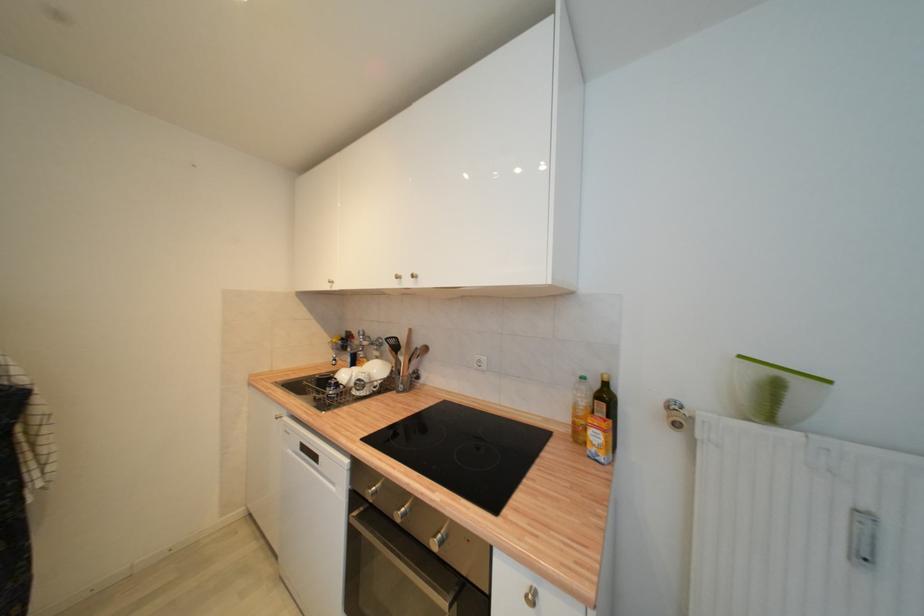
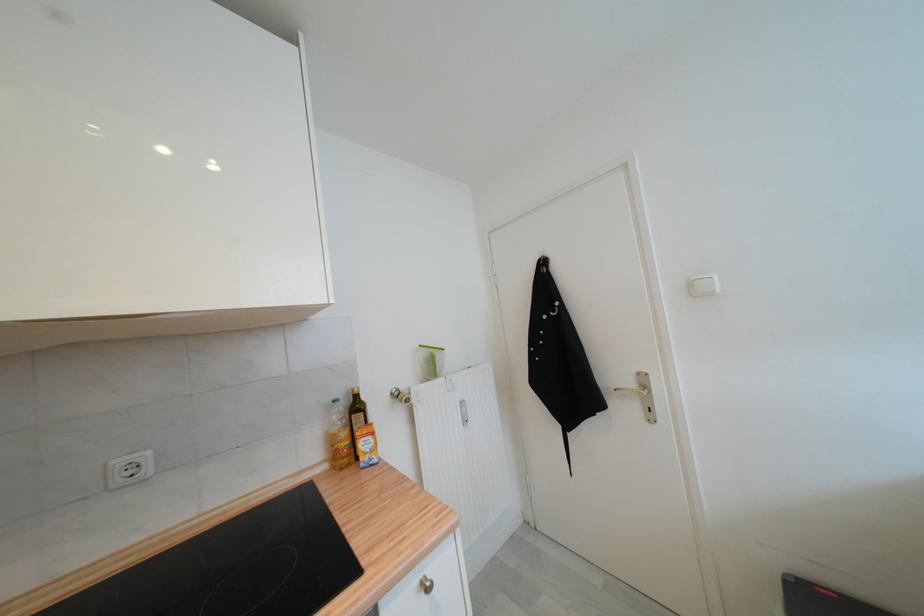
The point at (540,588) is marked in the first image. Where is the corresponding point in the second image?

(427, 578)